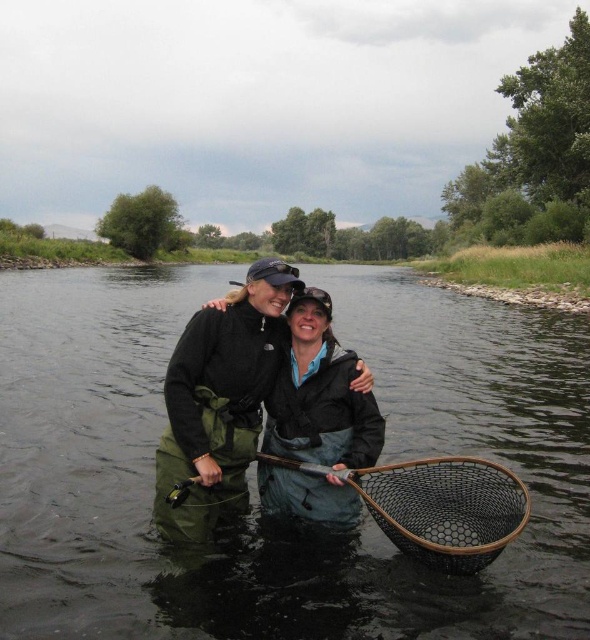
Does clear water at center have a greater height compared to black matte jacket at center?

Correct, clear water at center is much taller as black matte jacket at center.

What do you see at coordinates (254, 513) in the screenshot? I see `clear water at center` at bounding box center [254, 513].

This screenshot has width=590, height=640. What are the coordinates of `clear water at center` in the screenshot? It's located at (254, 513).

This screenshot has width=590, height=640. In order to click on clear water at center in this screenshot , I will do `click(254, 513)`.

Does green waterproof jacket at center lie behind black matte jacket at center?

Yes, green waterproof jacket at center is behind black matte jacket at center.

Does point (261, 371) lie in front of point (283, 502)?

No, it is behind (283, 502).

You are a GUI agent. You are given a task and a screenshot of the screen. Output one action in this format:
    pyautogui.click(x=<x>, y=<y>)
    Task: Click on the green waterproof jacket at center
    This screenshot has height=640, width=590.
    Given the screenshot: What is the action you would take?
    pyautogui.click(x=221, y=401)

Can you confirm if clear water at center is thinner than green waterproof jacket at center?

No.

Describe the element at coordinates (254, 513) in the screenshot. Image resolution: width=590 pixels, height=640 pixels. I see `clear water at center` at that location.

Identify the location of clear water at center. This screenshot has height=640, width=590. (254, 513).